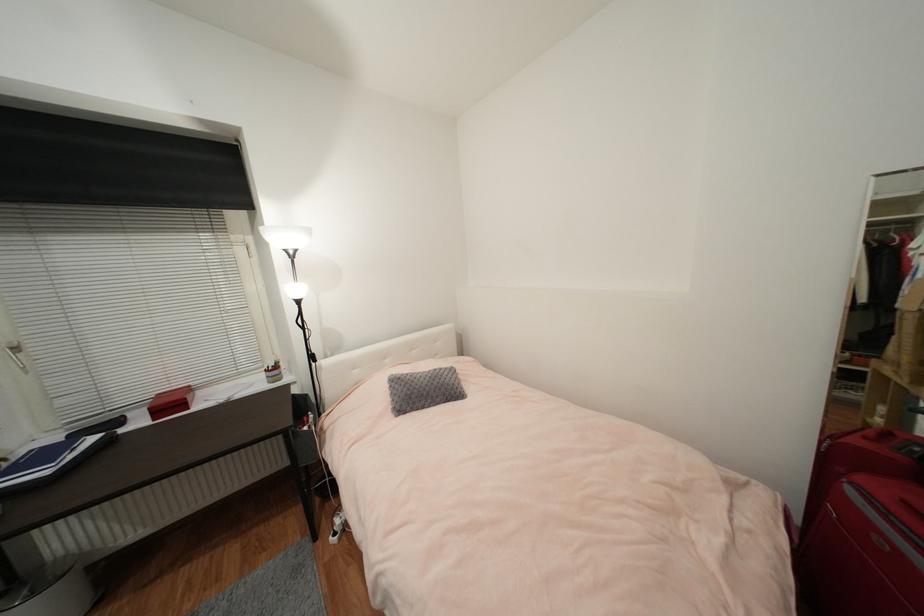
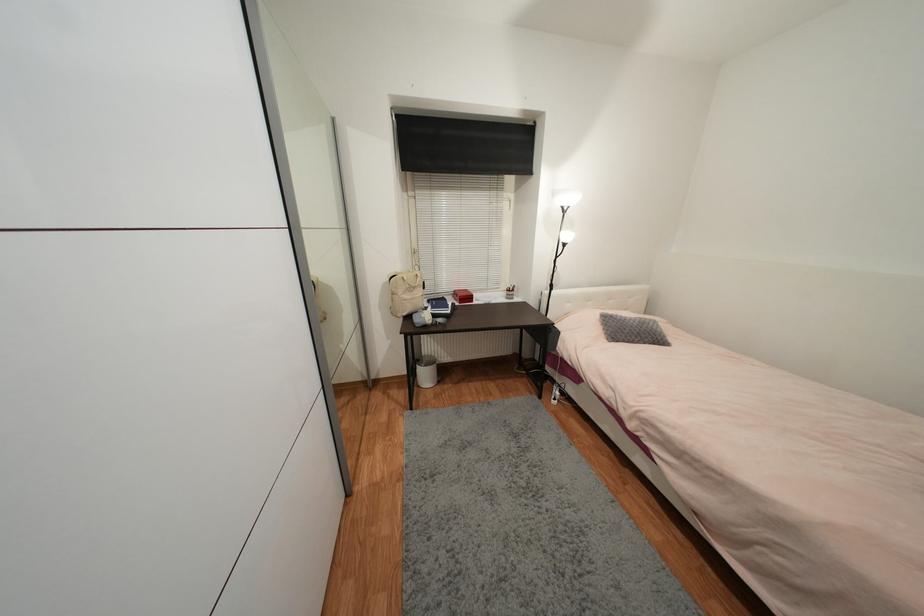
The point at (53, 561) is marked in the first image. Where is the corresponding point in the second image?

(428, 355)